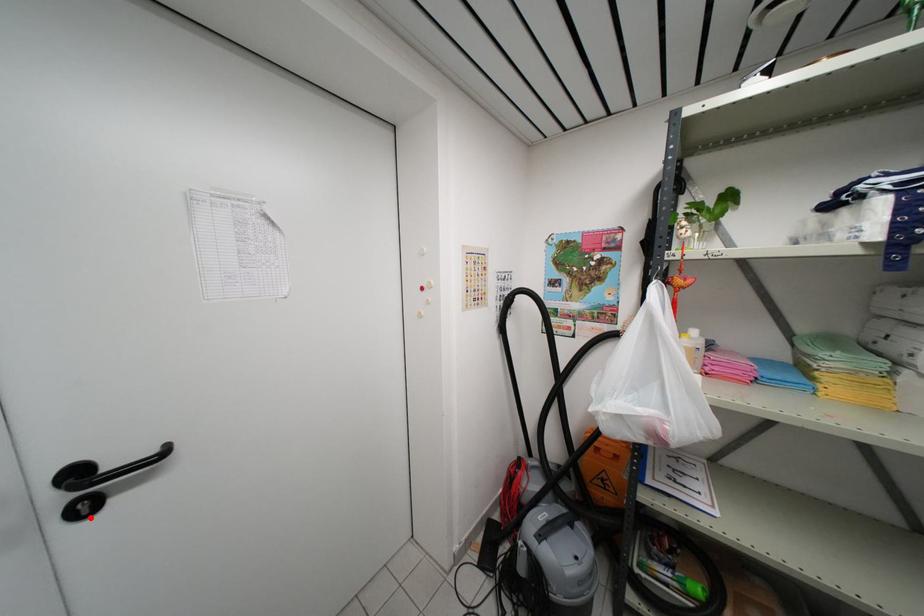
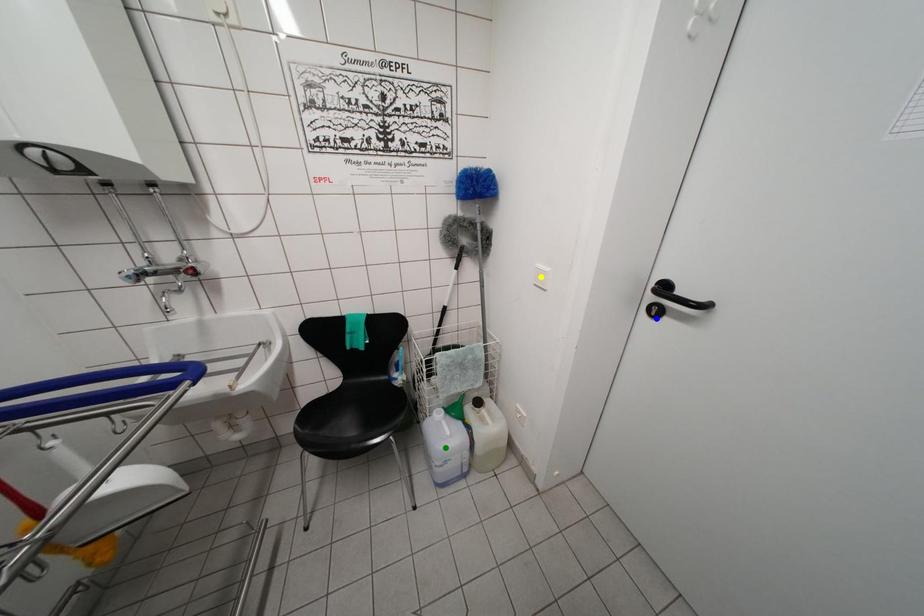
Question: I am providing you with two images of the same scene from different viewpoints. A red point is marked on the first image. You are given multiple points on the second image. Can you choose the point in image 2 that corresponds to the point in image 1?

Choices:
 (A) yellow point
 (B) blue point
 (C) green point

Answer: (B)